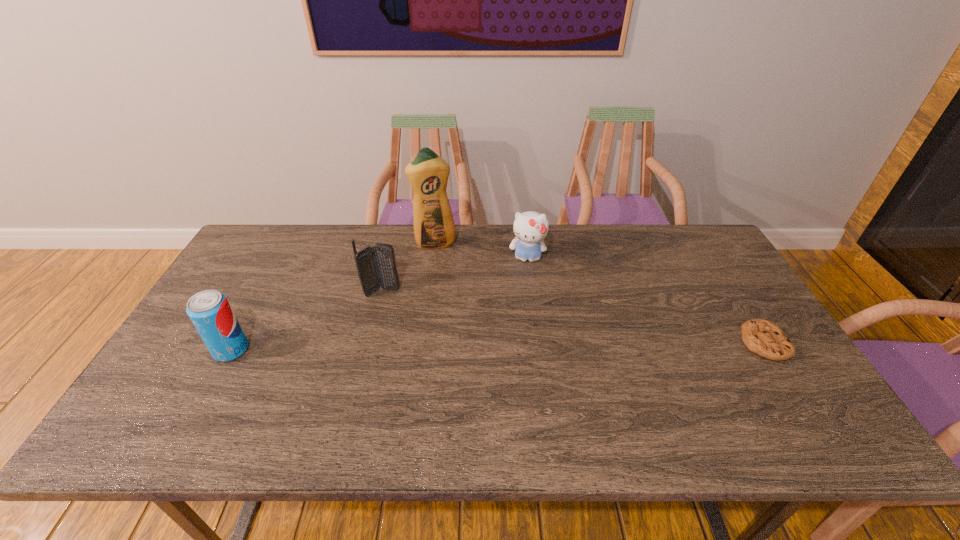
Find the location of a particular element. The width and height of the screenshot is (960, 540). soda can is located at coordinates 210,312.

This screenshot has width=960, height=540. I want to click on the shortest object, so (x=765, y=338).

Locate an element on the screen. The width and height of the screenshot is (960, 540). the rightmost object is located at coordinates (765, 338).

Find the location of a particular element. the tallest object is located at coordinates (434, 228).

What are the coordinates of `detergent` in the screenshot? It's located at (434, 228).

Locate an element on the screen. This screenshot has width=960, height=540. the second object from right to left is located at coordinates (530, 228).

What are the coordinates of `the second object from left to right` in the screenshot? It's located at (376, 266).

This screenshot has height=540, width=960. In order to click on the third nearest object in this screenshot , I will do (x=376, y=266).

Find the location of a particular element. The height and width of the screenshot is (540, 960). free spot located on the right of the soda can is located at coordinates (309, 350).

This screenshot has width=960, height=540. Identify the location of vacant space located 0.080m on the back of the rightmost object. (738, 303).